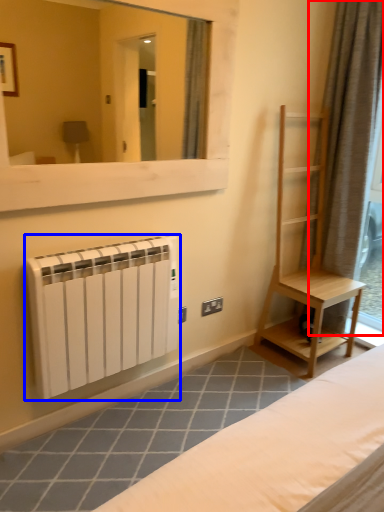
Question: Which object appears farthest to the camera in this image, curtain (highlighted by a red box) or radiator (highlighted by a blue box)?

Choices:
 (A) curtain
 (B) radiator

Answer: (A)